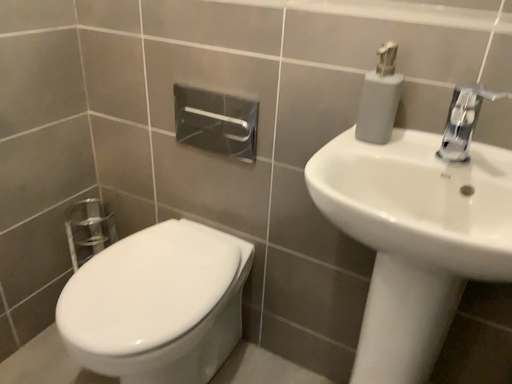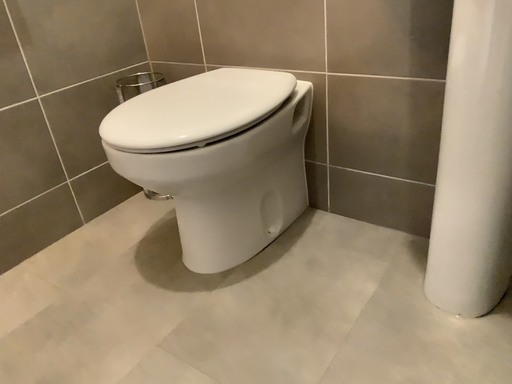
Question: Which way did the camera rotate in the video?

Choices:
 (A) rotated right
 (B) rotated left

Answer: (B)